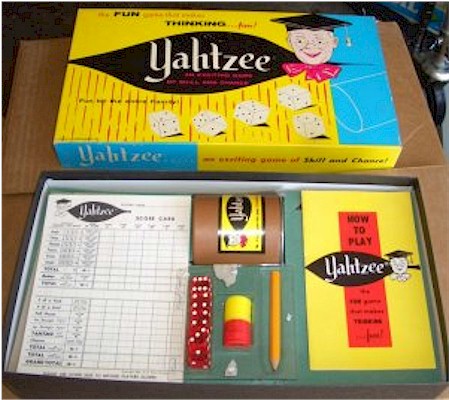
Find the location of a particular element. This screenshot has height=400, width=449. game score sheet is located at coordinates (125, 257).